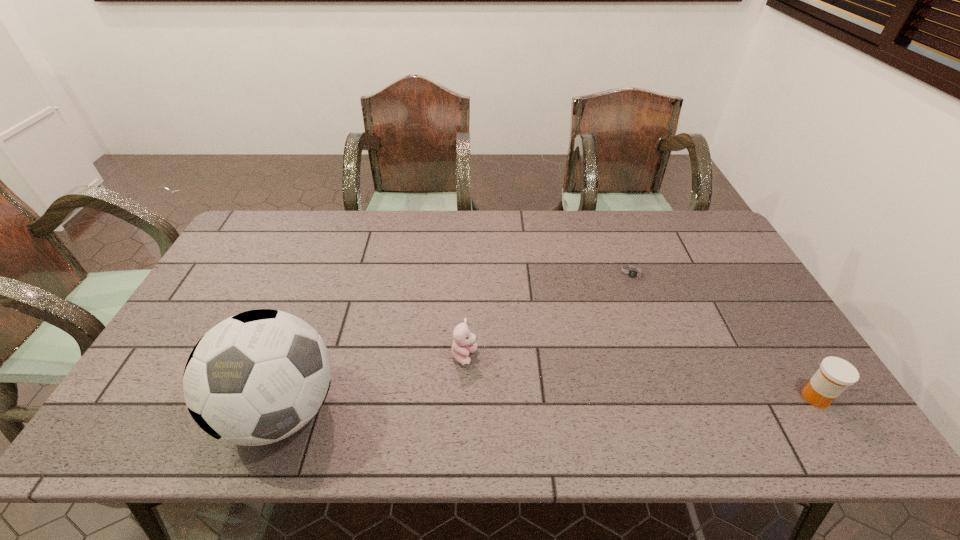
At what (x,y) coordinates should I click in order to perform the action: click on free space on the desktop that is between the soccer ball and the rightmost object and is positioned at the face of the teddy bear. Please return your answer as a coordinate pair (x, y). The width and height of the screenshot is (960, 540). Looking at the image, I should click on (529, 404).

The height and width of the screenshot is (540, 960). What are the coordinates of `vacant spot on the desktop that is between the soccer ball and the medicine and is positioned on the face of the farthest object` in the screenshot? It's located at (625, 402).